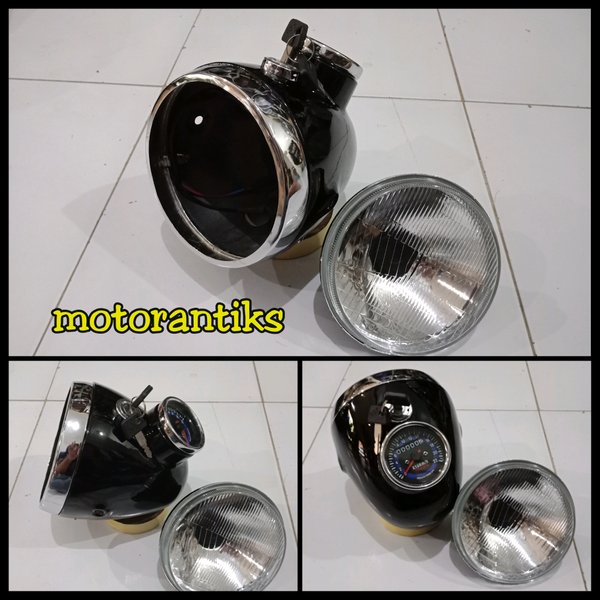
Locate an element on the screen. The width and height of the screenshot is (600, 600). white tiled floors is located at coordinates [335, 530], [256, 454], [524, 163].